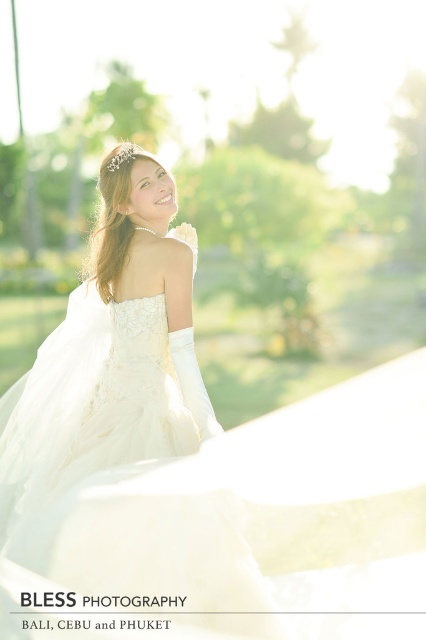
Question: Which point is closer to the camera taking this photo?

Choices:
 (A) (5, 515)
 (B) (120, 157)

Answer: (A)

Question: Can you confirm if ivory satin dress at center is positioned below silver metallic tiara at upper center?

Choices:
 (A) no
 (B) yes

Answer: (B)

Question: Can you confirm if ivory satin dress at center is wider than silver metallic tiara at upper center?

Choices:
 (A) no
 (B) yes

Answer: (B)

Question: Can you confirm if ivory satin dress at center is positioned to the right of silver metallic tiara at upper center?

Choices:
 (A) no
 (B) yes

Answer: (A)